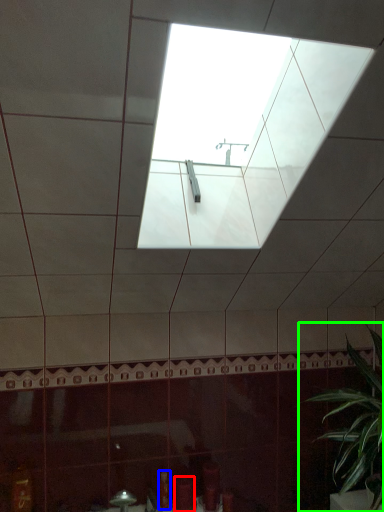
Question: Which object is positioned closest to toiletry (highlighted by a red box)? Select from toiletry (highlighted by a blue box) and houseplant (highlighted by a green box).

Choices:
 (A) toiletry
 (B) houseplant

Answer: (A)